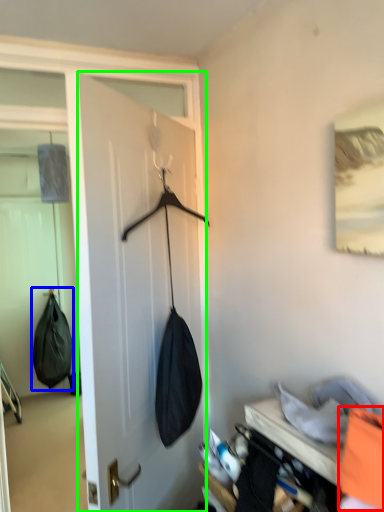
Question: Estimate the real-world distances between objects in this image. Which object is farther from clothing (highlighted by a red box), shoulder bag (highlighted by a blue box) or door (highlighted by a green box)?

Choices:
 (A) shoulder bag
 (B) door

Answer: (A)